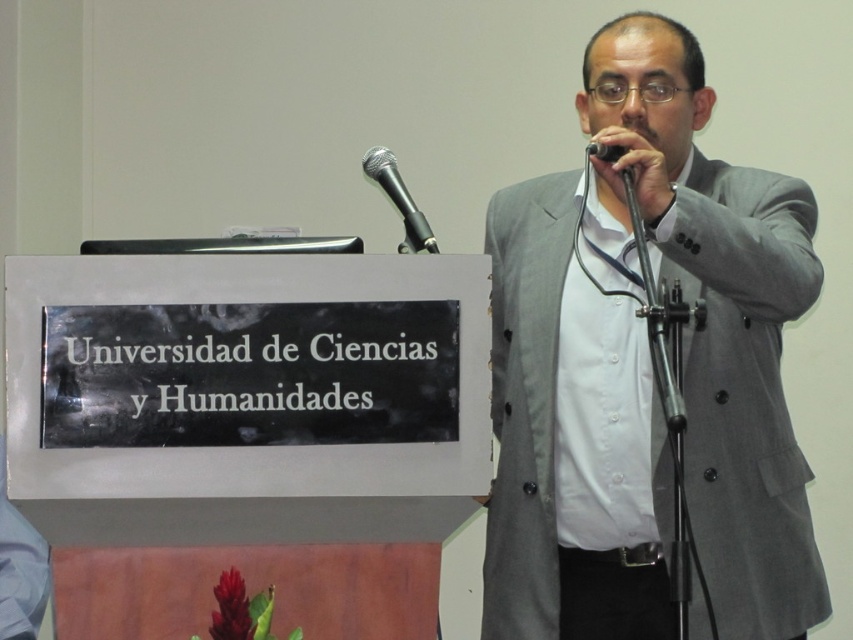
You are a photographer adjusting your camera settings to capture the scene. You notice two points in the image at coordinates point (x=724, y=481) and point (x=375, y=150). Which point should you focus on to ensure the foreground is sharp?

Point (x=724, y=481) is closer to the camera than point (x=375, y=150), so focusing on point (x=724, y=481) will ensure the foreground is sharp.

You are organizing a small event and need to know if the gray fabric suit at center can be placed inside a box designed for the black metallic microphone at upper center. Can it fit?

The gray fabric suit at center is bigger than the black metallic microphone at upper center, so it cannot fit inside the box designed for the microphone.